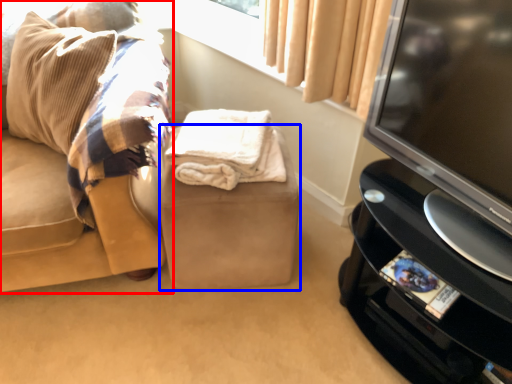
Question: Which point is further to the camera, studio couch (highlighted by a red box) or stool (highlighted by a blue box)?

Choices:
 (A) studio couch
 (B) stool

Answer: (B)